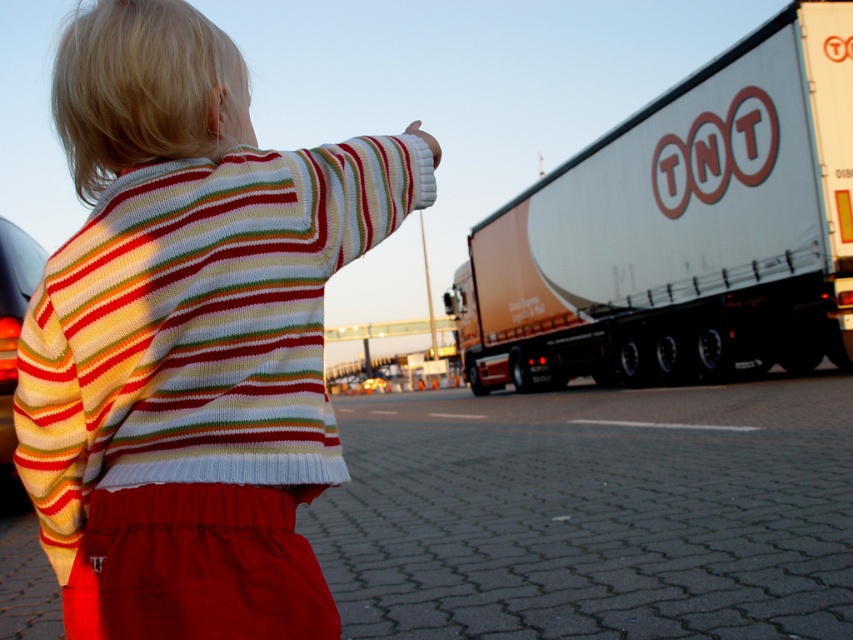
You are a fashion designer observing the image and want to compare the height of the knitted sweater at upper left and the white glossy trailer at right. Which one is taller?

The knitted sweater at upper left is not as tall as the white glossy trailer at right, so the white glossy trailer at right is taller.